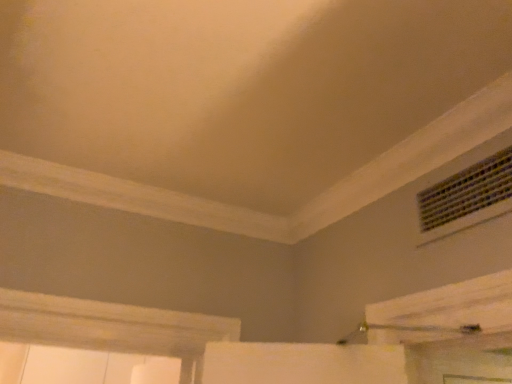
The image size is (512, 384). What do you see at coordinates (466, 198) in the screenshot?
I see `metallic grid air conditioning at upper right` at bounding box center [466, 198].

What is the approximate width of metallic grid air conditioning at upper right?

metallic grid air conditioning at upper right is 2.36 inches in width.

Identify the location of metallic grid air conditioning at upper right. This screenshot has width=512, height=384. (466, 198).

You are a GUI agent. You are given a task and a screenshot of the screen. Output one action in this format:
    pyautogui.click(x=<x>, y=<y>)
    Task: Click on the metallic grid air conditioning at upper right
    Image resolution: width=512 pixels, height=384 pixels.
    Given the screenshot: What is the action you would take?
    pyautogui.click(x=466, y=198)